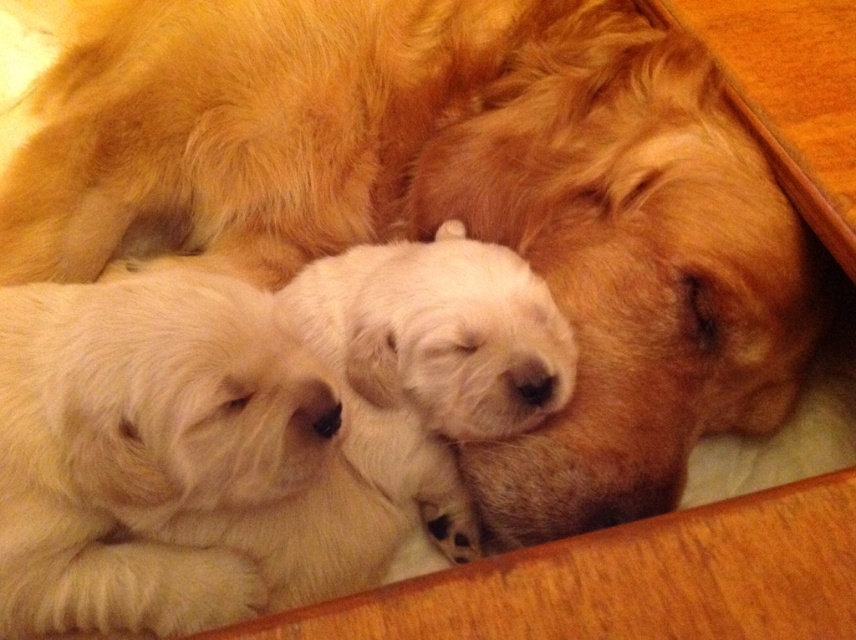
Question: Does white fluffy puppy at left come behind white fluffy puppies at center?

Choices:
 (A) yes
 (B) no

Answer: (B)

Question: Observing the image, what is the correct spatial positioning of white fluffy puppy at left in reference to white fluffy puppies at center?

Choices:
 (A) below
 (B) above

Answer: (A)

Question: Is white fluffy puppy at left smaller than white fluffy puppies at center?

Choices:
 (A) yes
 (B) no

Answer: (A)

Question: Which point is closer to the camera?

Choices:
 (A) white fluffy puppies at center
 (B) white fluffy puppy at left

Answer: (B)